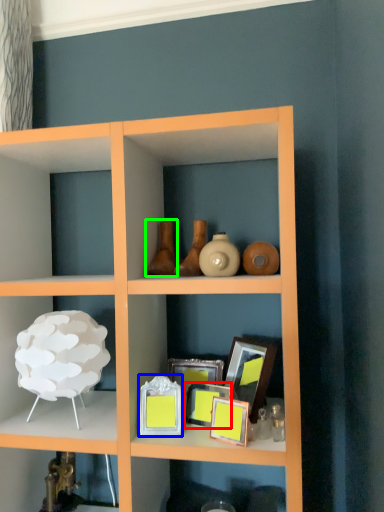
Question: Which is farther away from picture frame (highlighted by a red box)? picture frame (highlighted by a blue box) or vase (highlighted by a green box)?

Choices:
 (A) picture frame
 (B) vase

Answer: (B)